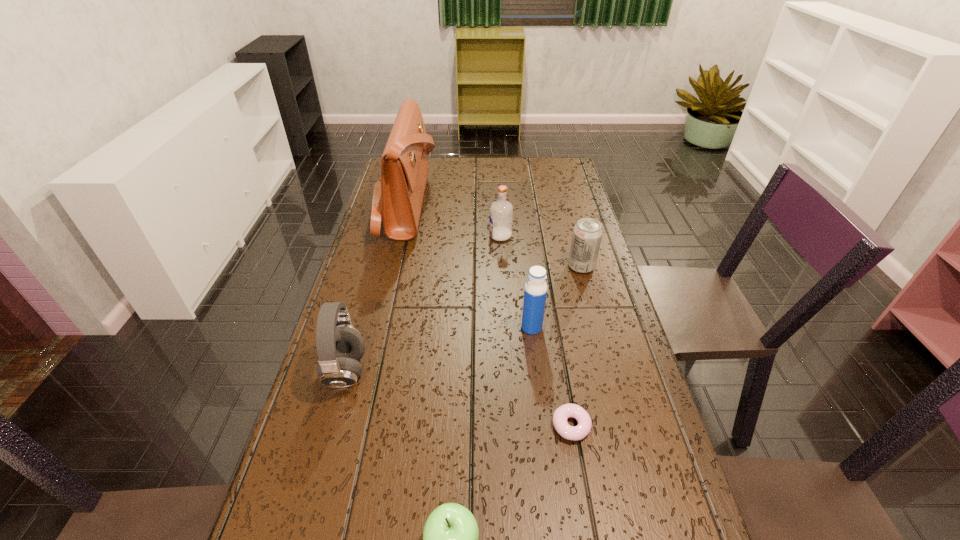
Where is `the tallest object`? The width and height of the screenshot is (960, 540). the tallest object is located at coordinates (398, 195).

Locate an element on the screen. The image size is (960, 540). headset is located at coordinates (340, 346).

The width and height of the screenshot is (960, 540). I want to click on the fourth farthest object, so (535, 291).

I want to click on the fourth object from left to right, so click(501, 211).

I want to click on the fifth tallest object, so click(587, 234).

Image resolution: width=960 pixels, height=540 pixels. In order to click on soda can in this screenshot , I will do `click(587, 234)`.

Where is `the second nearest object`? Image resolution: width=960 pixels, height=540 pixels. the second nearest object is located at coordinates 574,433.

Locate an element on the screen. The width and height of the screenshot is (960, 540). doughnut is located at coordinates (574, 433).

Identify the location of blank space located on the front flap of the satchel. (482, 205).

I want to click on vacant point located on the ear cups of the headset, so click(420, 372).